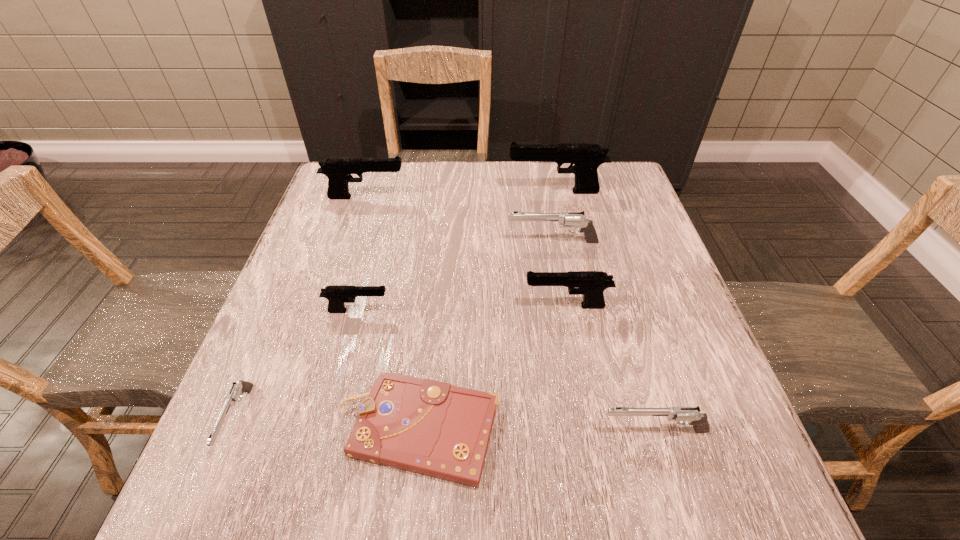
Find the location of a particular element. This screenshot has height=540, width=960. the tallest pistol is located at coordinates point(586,158).

Identify the location of the biggest black pistol. (586, 158).

This screenshot has width=960, height=540. I want to click on the sixth shortest pistol, so click(338, 170).

Where is `the seventh shortest object`? the seventh shortest object is located at coordinates (338, 170).

I want to click on the third biggest black pistol, so click(591, 284).

Identify the location of the farthest silver pistol. The width and height of the screenshot is (960, 540). (565, 219).

The image size is (960, 540). In order to click on the third farthest pistol in this screenshot , I will do `click(565, 219)`.

Find the location of `the smallest black pistol`. the smallest black pistol is located at coordinates (337, 295).

Find the location of `the second biggest silver pistol`. the second biggest silver pistol is located at coordinates (682, 415).

Find the location of `the shortest pistol`. the shortest pistol is located at coordinates click(239, 387).